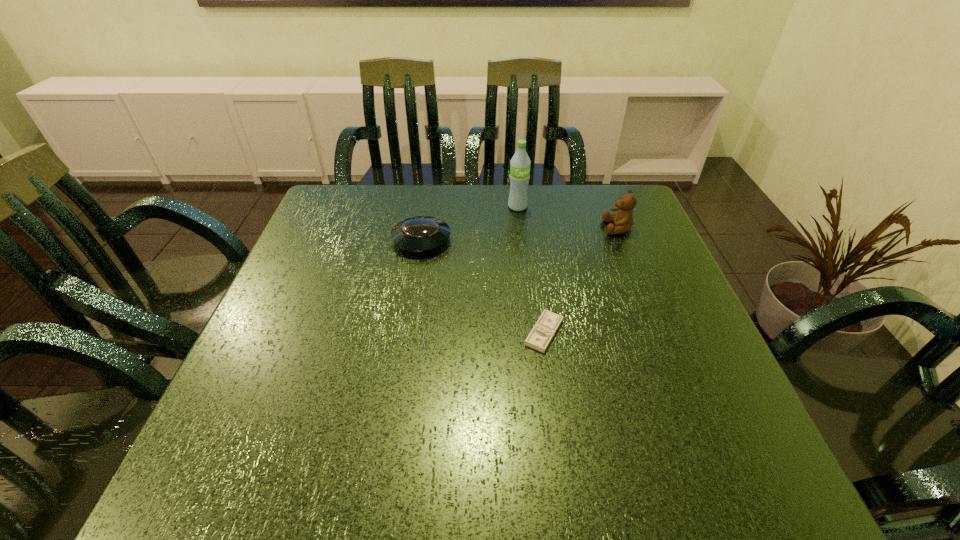
Find the location of `vacant space at the near edge of the desktop`. vacant space at the near edge of the desktop is located at coordinates (499, 488).

In the image, there is a desktop. Where is `free space at the left edge`? free space at the left edge is located at coordinates (334, 236).

The width and height of the screenshot is (960, 540). In the image, there is a desktop. Find the location of `vacant region at the right edge`. vacant region at the right edge is located at coordinates (677, 342).

Image resolution: width=960 pixels, height=540 pixels. What are the coordinates of `free region at the far left corner of the desktop` in the screenshot? It's located at (336, 232).

In the image, there is a desktop. In order to click on free space at the near left corner in this screenshot , I will do `click(277, 474)`.

Identify the location of vacant space at the far right corner of the desktop. Image resolution: width=960 pixels, height=540 pixels. (614, 192).

Identify the location of vacant space that is in between the rightmost object and the money. The height and width of the screenshot is (540, 960). coord(581,280).

At what (x,y) coordinates should I click in order to perform the action: click on free space between the water bottle and the shortest object. Please return your answer as a coordinate pair (x, y). The image size is (960, 540). Looking at the image, I should click on (531, 269).

Identify the location of vacant area that lies between the tallest object and the nearest object. This screenshot has height=540, width=960. (531, 269).

Identify the location of blank region between the second shortest object and the shortest object. This screenshot has width=960, height=540. (483, 286).